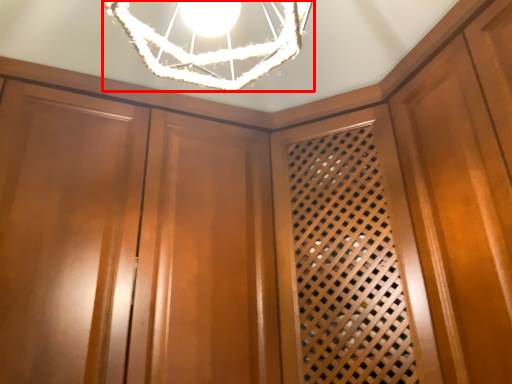
Question: From the image's perspective, where is lamp (annotated by the red box) located in relation to cabinetry in the image?

Choices:
 (A) below
 (B) above

Answer: (B)